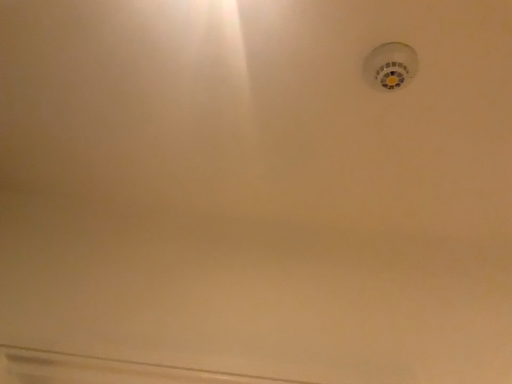
Question: Should I look upward or downward to see white plastic smoke detector at upper right?

Choices:
 (A) up
 (B) down

Answer: (A)